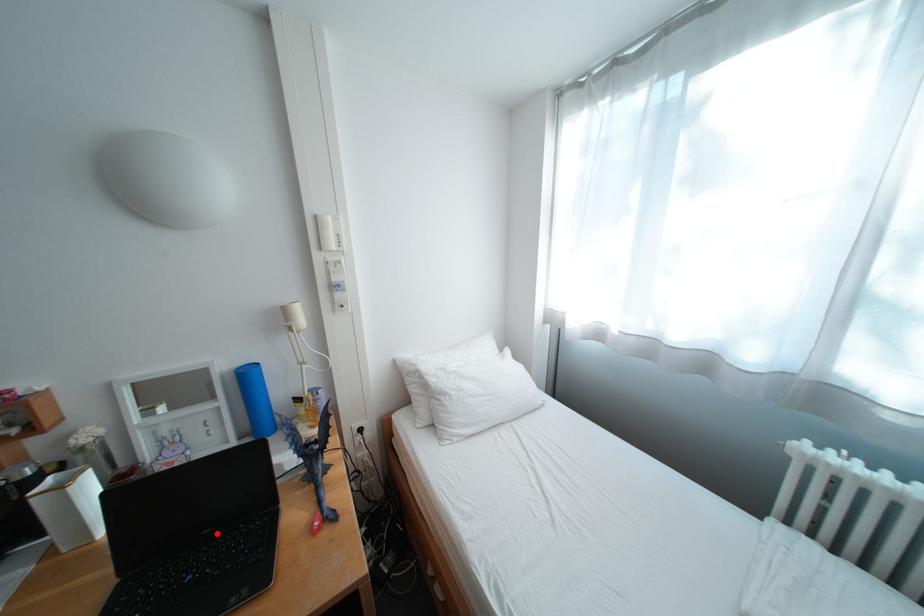
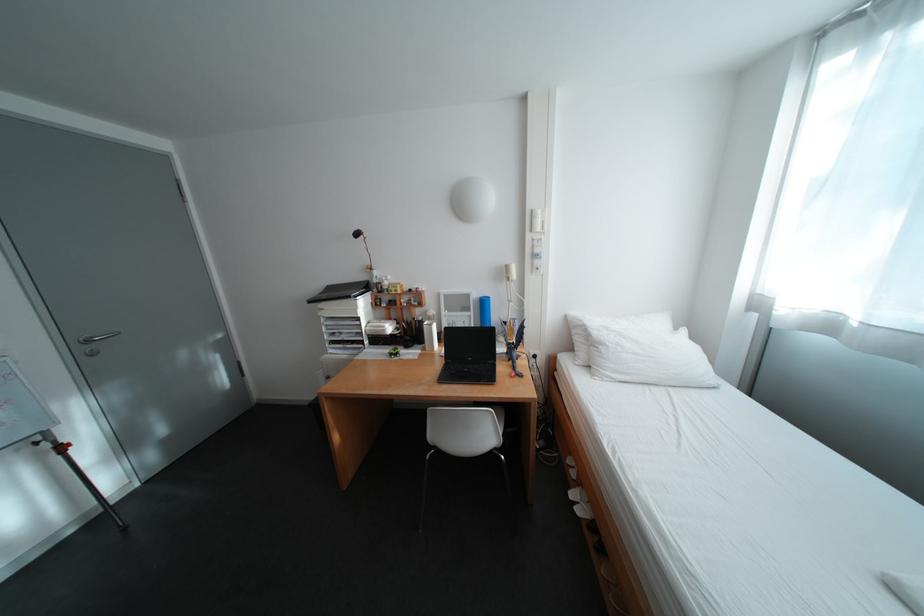
Question: I am providing you with two images of the same scene from different viewpoints. A red point is marked on the first image. Can you still see the location of the red point in image 2?

Choices:
 (A) Yes
 (B) No

Answer: (A)